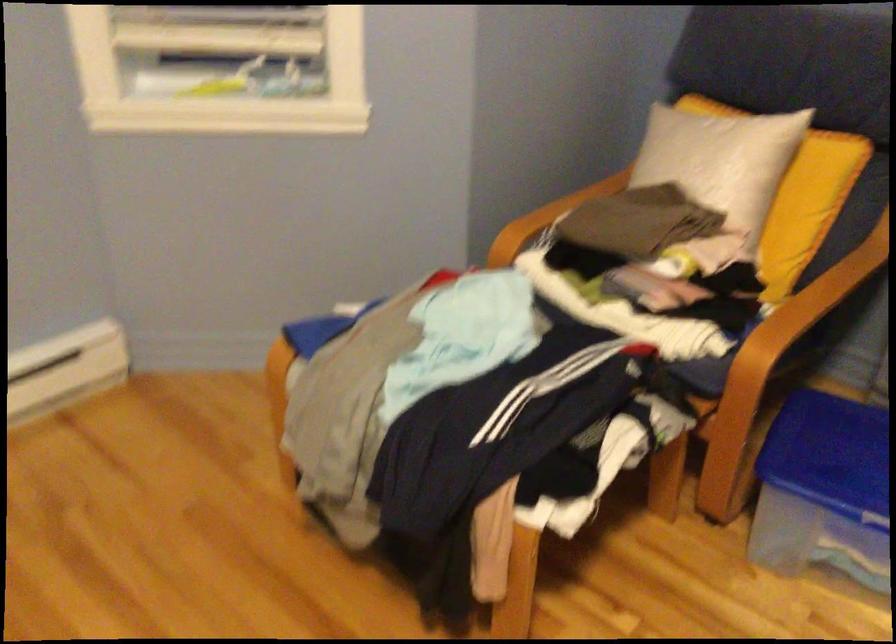
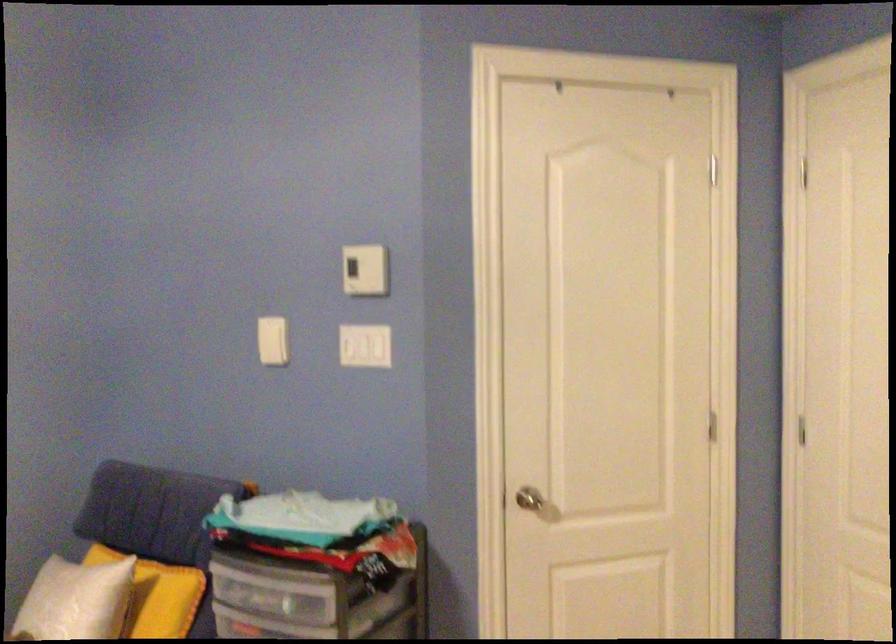
Find the pixel in the second image that matches the point at 806,156 in the first image.

(157, 594)